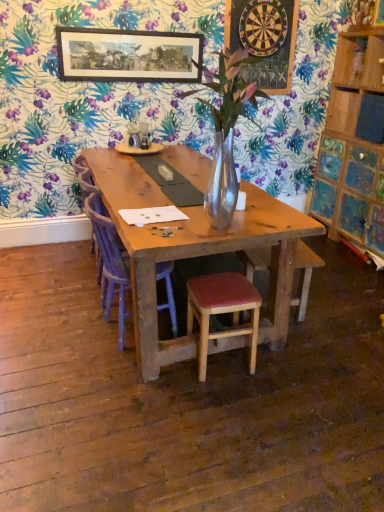
At what (x,y) coordinates should I click in order to perform the action: click on blank space situated above wooden stool with red cushion at center (from a real-world perspective). Please return your answer as a coordinate pair (x, y). Looking at the image, I should click on (223, 288).